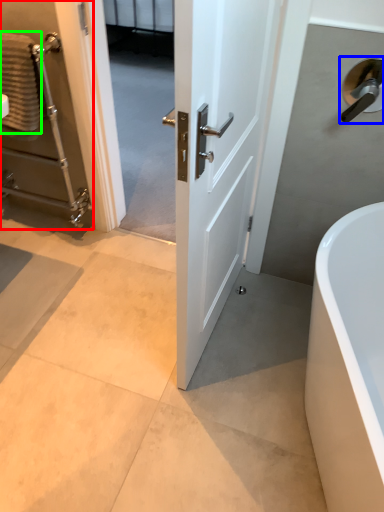
Question: Which object is positioned closest to elevator (highlighted by a red box)? Select from door handle (highlighted by a blue box) and material (highlighted by a green box).

Choices:
 (A) door handle
 (B) material

Answer: (B)